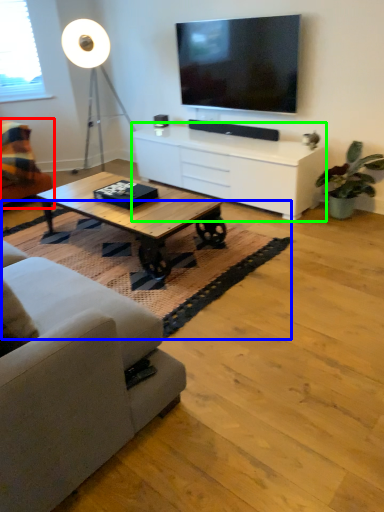
Question: Based on their relative distances, which object is farther from studio couch (highlighted by a red box)? Choose from mat (highlighted by a blue box) and cabinetry (highlighted by a green box).

Choices:
 (A) mat
 (B) cabinetry

Answer: (B)